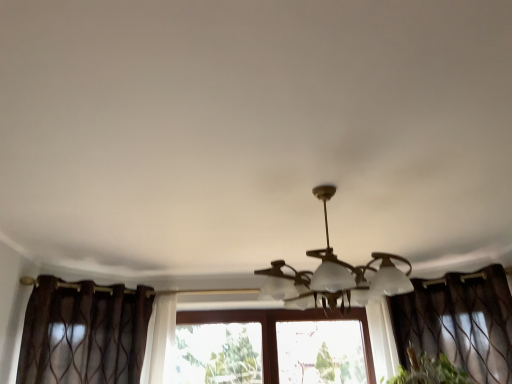
Question: From a real-world perspective, is matte white lamp at center positioned under brown sheer curtain at left, arranged as the first curtain when viewed from the left, based on gravity?

Choices:
 (A) no
 (B) yes

Answer: (A)

Question: Is matte white lamp at center positioned in front of brown sheer curtain at left, positioned as the second curtain in right-to-left order?

Choices:
 (A) yes
 (B) no

Answer: (A)

Question: Would you say matte white lamp at center is outside brown sheer curtain at left, positioned as the second curtain in right-to-left order?

Choices:
 (A) yes
 (B) no

Answer: (A)

Question: From the image's perspective, does matte white lamp at center appear higher than brown sheer curtain at left, arranged as the first curtain when viewed from the left?

Choices:
 (A) no
 (B) yes

Answer: (B)

Question: Is matte white lamp at center far from brown sheer curtain at left, positioned as the second curtain in right-to-left order?

Choices:
 (A) yes
 (B) no

Answer: (A)

Question: From the image's perspective, is matte white lamp at center positioned above or below brown sheer curtain at left, positioned as the second curtain in right-to-left order?

Choices:
 (A) above
 (B) below

Answer: (A)

Question: Is matte white lamp at center taller or shorter than brown sheer curtain at left, positioned as the second curtain in right-to-left order?

Choices:
 (A) tall
 (B) short

Answer: (B)

Question: Does point (314, 256) appear closer or farther from the camera than point (96, 321)?

Choices:
 (A) closer
 (B) farther

Answer: (A)

Question: Relative to brown sheer curtain at left, positioned as the second curtain in right-to-left order, is matte white lamp at center in front or behind?

Choices:
 (A) behind
 (B) front

Answer: (B)

Question: Is brown sheer curtain at left, arranged as the first curtain when viewed from the left, wider or thinner than brown sheer curtain at right, which is the first curtain from right to left?

Choices:
 (A) thin
 (B) wide

Answer: (A)

Question: Looking at the image, does brown sheer curtain at left, arranged as the first curtain when viewed from the left, seem bigger or smaller compared to brown sheer curtain at right, which ranks as the second curtain in left-to-right order?

Choices:
 (A) big
 (B) small

Answer: (B)

Question: Does point (72, 375) appear closer or farther from the camera than point (490, 334)?

Choices:
 (A) farther
 (B) closer

Answer: (B)

Question: Is brown sheer curtain at left, positioned as the second curtain in right-to-left order, in front of or behind brown sheer curtain at right, which is the first curtain from right to left, in the image?

Choices:
 (A) behind
 (B) front

Answer: (B)

Question: Is brown sheer curtain at right, which is the first curtain from right to left, wider or thinner than matte white lamp at center?

Choices:
 (A) wide
 (B) thin

Answer: (B)

Question: From the image's perspective, is brown sheer curtain at right, which is the first curtain from right to left, located above or below matte white lamp at center?

Choices:
 (A) below
 (B) above

Answer: (A)